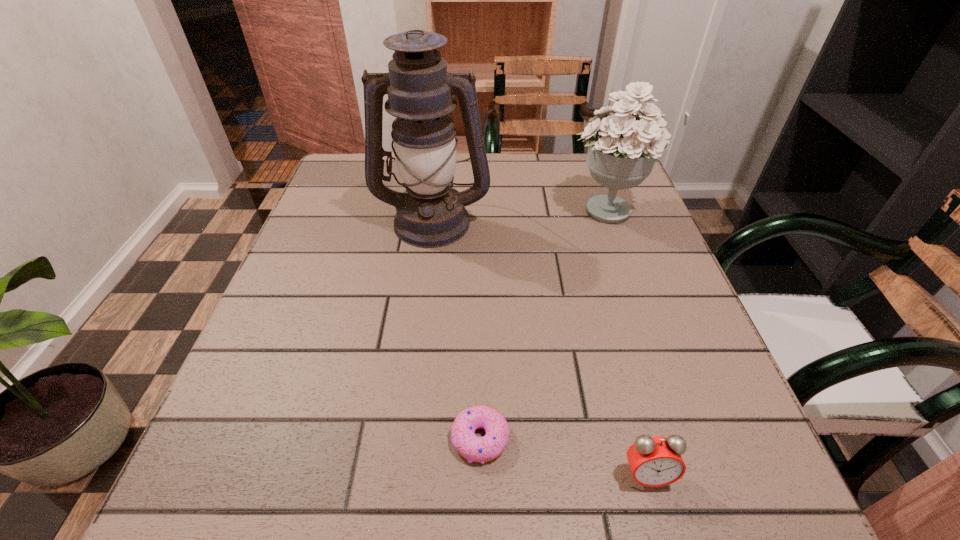
The height and width of the screenshot is (540, 960). Identify the location of the tallest object. (430, 213).

Locate an element on the screen. Image resolution: width=960 pixels, height=540 pixels. bouquet is located at coordinates (622, 149).

This screenshot has width=960, height=540. I want to click on the third tallest object, so click(x=655, y=461).

The width and height of the screenshot is (960, 540). I want to click on the shortest object, so click(x=473, y=448).

This screenshot has height=540, width=960. Find the location of `vacant region located 0.300m on the right of the oil lamp`. vacant region located 0.300m on the right of the oil lamp is located at coordinates 616,221.

Locate an element on the screen. Image resolution: width=960 pixels, height=540 pixels. vacant space located on the front of the bouquet is located at coordinates (630, 273).

Where is `free space located on the left of the shortest object`? This screenshot has width=960, height=540. free space located on the left of the shortest object is located at coordinates (256, 438).

Identify the location of oil lamp present at the far edge. (430, 213).

Find the location of `bouquet at the far edge`. bouquet at the far edge is located at coordinates (622, 149).

Locate an element on the screen. This screenshot has width=960, height=540. alarm clock present at the near edge is located at coordinates (655, 461).